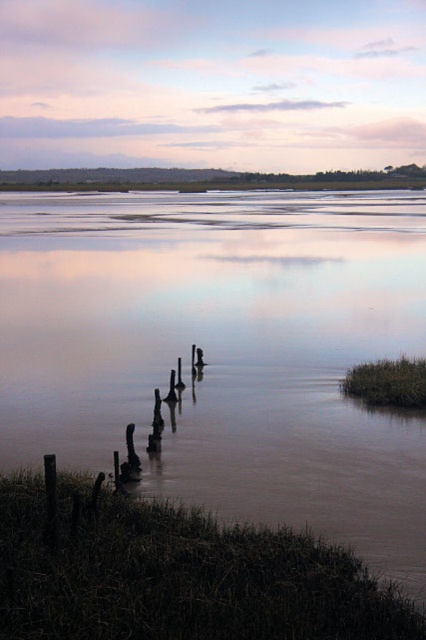
Question: Which of the following is the farthest from the observer?

Choices:
 (A) (114, 416)
 (B) (276, 589)

Answer: (A)

Question: Can you confirm if brown muddy water at lower left is positioned above dark brown wood posts at lower left?

Choices:
 (A) yes
 (B) no

Answer: (A)

Question: Can you confirm if brown muddy water at lower left is thinner than dark brown wood posts at lower left?

Choices:
 (A) yes
 (B) no

Answer: (B)

Question: Can you confirm if brown muddy water at lower left is wider than dark brown wood posts at lower left?

Choices:
 (A) no
 (B) yes

Answer: (B)

Question: Which object is farther from the camera taking this photo?

Choices:
 (A) dark brown wood posts at lower left
 (B) brown muddy water at lower left

Answer: (B)